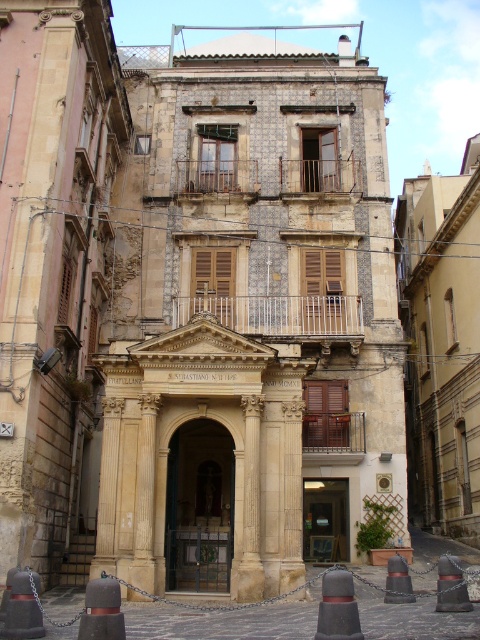
Does matte glass door at center appear over black rubber traffic cone at lower left?

Actually, matte glass door at center is below black rubber traffic cone at lower left.

What do you see at coordinates (324, 520) in the screenshot?
I see `matte glass door at center` at bounding box center [324, 520].

The width and height of the screenshot is (480, 640). In order to click on matte glass door at center in this screenshot , I will do `click(324, 520)`.

How much distance is there between smooth stone column at center and brushed metal traffic cone at lower right?

smooth stone column at center and brushed metal traffic cone at lower right are 12.82 meters apart.

Is smooth stone column at center closer to the viewer compared to brushed metal traffic cone at lower right?

No, smooth stone column at center is further to the viewer.

The height and width of the screenshot is (640, 480). I want to click on smooth stone column at center, so click(251, 506).

Is point (319, 560) positioned behind point (394, 561)?

Yes, point (319, 560) is behind point (394, 561).

Does matte glass door at center have a larger size compared to smooth black cone at lower center?

No.

Who is more distant from viewer, (338,484) or (404,593)?

Positioned behind is point (338,484).

The height and width of the screenshot is (640, 480). I want to click on matte glass door at center, so click(x=324, y=520).